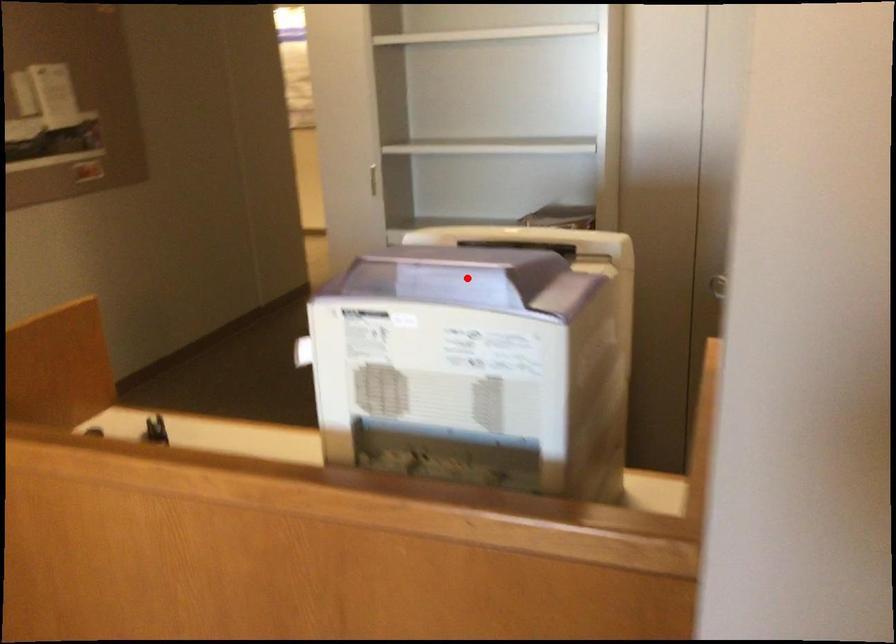
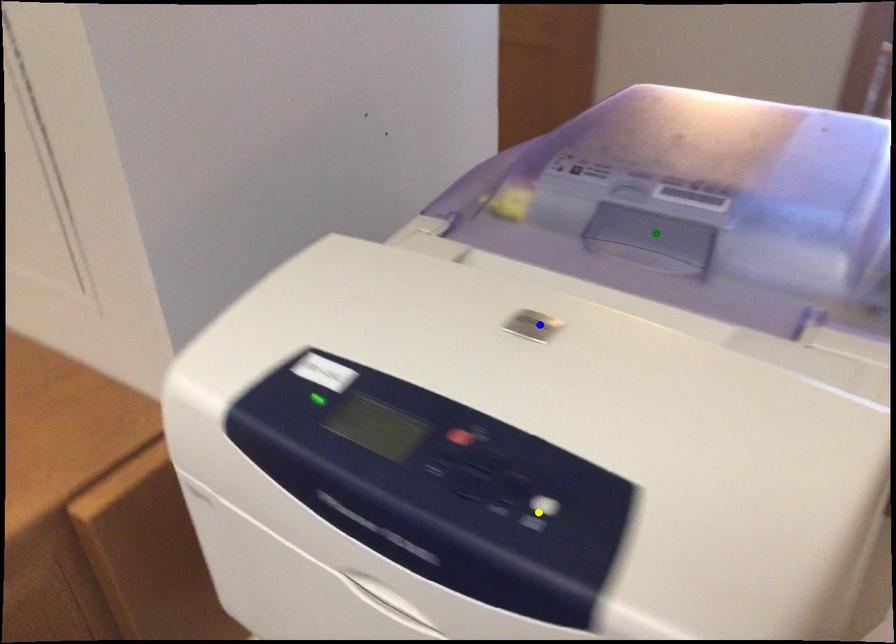
Question: I am providing you with two images of the same scene from different viewpoints. A red point is marked on the first image. You are given multiple points on the second image. Which point in image 2 represents the same 3d spot as the red point in image 1?

Choices:
 (A) yellow point
 (B) green point
 (C) blue point

Answer: (B)